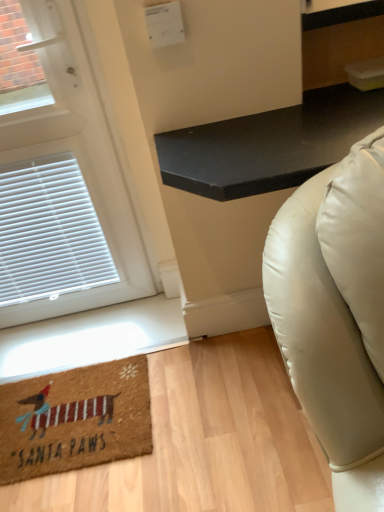
What are the coordinates of `vacant area situated below white matte door at upper left (from a real-world perspective)` in the screenshot? It's located at (80, 318).